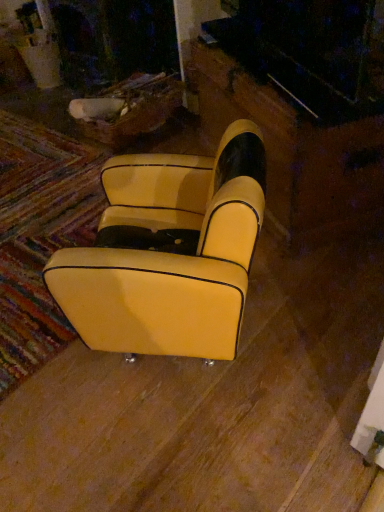
You are a GUI agent. You are given a task and a screenshot of the screen. Output one action in this format:
    pyautogui.click(x=<x>, y=<y>)
    Task: Click on the vacant area in front of yellow leather chair at center
    Image resolution: width=384 pixels, height=512 pixels.
    Given the screenshot: What is the action you would take?
    pyautogui.click(x=189, y=439)